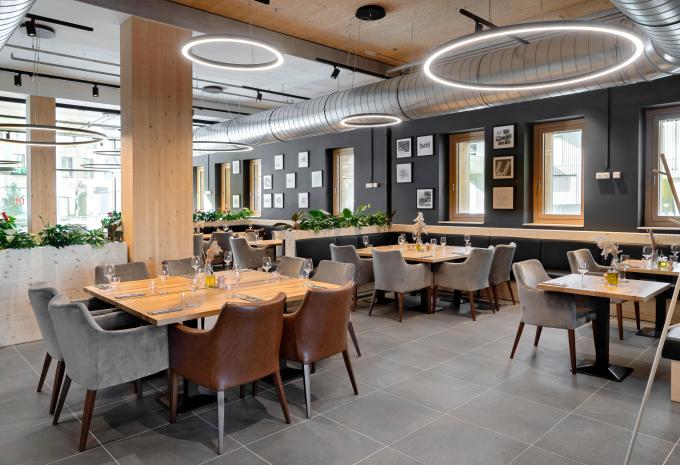
I want to click on tables, so click(x=224, y=292), click(x=624, y=289), click(x=653, y=262), click(x=425, y=248), click(x=264, y=239), click(x=205, y=235).